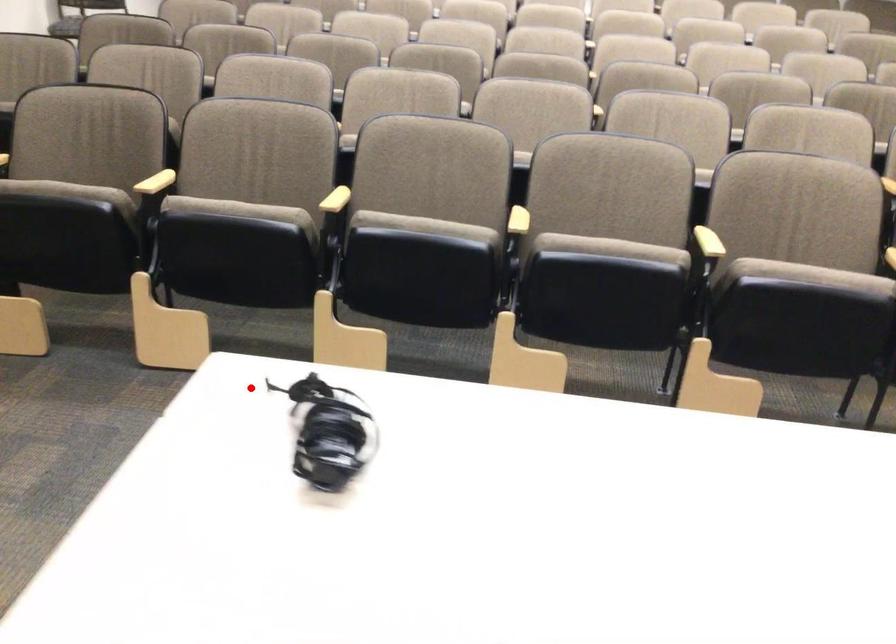
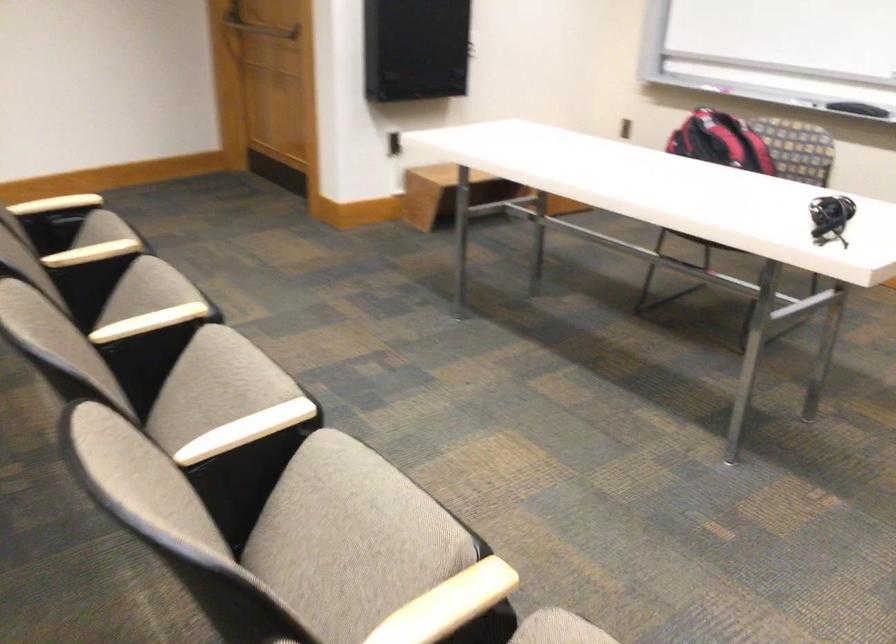
The point at the highlighted location is marked in the first image. Where is the corresponding point in the second image?

(830, 218)